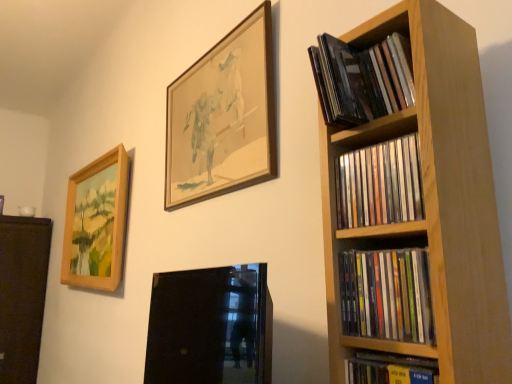
Question: Considering the relative sizes of wooden-framed painting at left, the third picture frame positioned from the front, and matte black cds at upper right, arranged as the first book when viewed from the top, in the image provided, is wooden-framed painting at left, the third picture frame positioned from the front, thinner than matte black cds at upper right, arranged as the first book when viewed from the top,?

Choices:
 (A) no
 (B) yes

Answer: (A)

Question: Is wooden-framed painting at left, which ranks as the 1th picture frame in left-to-right order, surrounding matte black cds at upper right, which is the fourth book in bottom-to-top order?

Choices:
 (A) no
 (B) yes

Answer: (A)

Question: Is wooden-framed painting at left, arranged as the first picture frame when viewed from the back, turned away from matte black cds at upper right, arranged as the first book when viewed from the top?

Choices:
 (A) yes
 (B) no

Answer: (B)

Question: From a real-world perspective, is wooden-framed painting at left, which ranks as the 1th picture frame in left-to-right order, physically below matte black cds at upper right, which is the fourth book in bottom-to-top order?

Choices:
 (A) no
 (B) yes

Answer: (B)

Question: From the image's perspective, is wooden-framed painting at left, the third picture frame positioned from the front, located beneath matte black cds at upper right, arranged as the first book when viewed from the top?

Choices:
 (A) no
 (B) yes

Answer: (B)

Question: Considering the relative positions of wooden-framed painting at left, arranged as the first picture frame when viewed from the back, and matte black cds at upper right, arranged as the first book when viewed from the top, in the image provided, is wooden-framed painting at left, arranged as the first picture frame when viewed from the back, to the left of matte black cds at upper right, arranged as the first book when viewed from the top, from the viewer's perspective?

Choices:
 (A) yes
 (B) no

Answer: (A)

Question: Is matte plastic cds at right, arranged as the 3th book when viewed from the top, to the left of wooden picture frame at upper center, which is the 2th picture frame in front-to-back order, from the viewer's perspective?

Choices:
 (A) no
 (B) yes

Answer: (A)

Question: From a real-world perspective, is matte plastic cds at right, arranged as the 3th book when viewed from the top, on wooden picture frame at upper center, acting as the second picture frame starting from the back?

Choices:
 (A) no
 (B) yes

Answer: (A)

Question: From the image's perspective, would you say matte plastic cds at right, the second book ordered from the bottom, is positioned over wooden picture frame at upper center, acting as the second picture frame starting from the back?

Choices:
 (A) no
 (B) yes

Answer: (A)

Question: Can you confirm if matte plastic cds at right, the second book ordered from the bottom, is positioned to the right of wooden picture frame at upper center, which is the 3th picture frame from left to right?

Choices:
 (A) yes
 (B) no

Answer: (A)

Question: Is matte plastic cds at right, arranged as the 3th book when viewed from the top, far away from wooden picture frame at upper center, the first picture frame when ordered from right to left?

Choices:
 (A) no
 (B) yes

Answer: (A)

Question: Is wooden picture frame at upper center, acting as the second picture frame starting from the back, located within matte plastic cds at right, the second book ordered from the bottom?

Choices:
 (A) no
 (B) yes

Answer: (A)

Question: Is matte black cds at upper right, arranged as the first book when viewed from the top, located outside hardcover book at lower right, the fourth book when ordered from top to bottom?

Choices:
 (A) yes
 (B) no

Answer: (A)